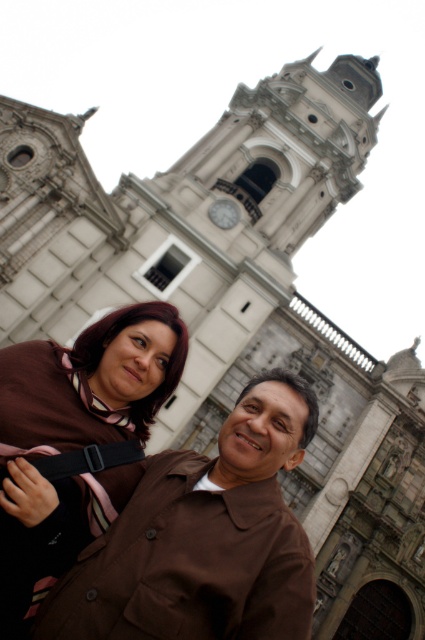
Does brown matte jacket at center have a larger size compared to brown fabric at center?

Yes, brown matte jacket at center is bigger than brown fabric at center.

Does point (181, 508) come in front of point (76, 342)?

Yes, it is in front of point (76, 342).

Describe the element at coordinates (203, 538) in the screenshot. I see `brown matte jacket at center` at that location.

Find the location of a particular element. Image resolution: width=425 pixels, height=640 pixels. brown matte jacket at center is located at coordinates (203, 538).

Can you confirm if brown fabric at lower left is smaller than brown fabric at center?

Incorrect, brown fabric at lower left is not smaller in size than brown fabric at center.

Is point (164, 305) positioned behind point (176, 332)?

Yes, it is behind point (176, 332).

Which is in front, point (51, 342) or point (181, 336)?

Point (51, 342) is more forward.

Identify the location of brown fabric at lower left. The width and height of the screenshot is (425, 640). (76, 436).

Who is positioned more to the right, brown matte jacket at center or matte brown jacket at lower center?

matte brown jacket at lower center is more to the right.

Is brown matte jacket at center closer to the viewer compared to matte brown jacket at lower center?

Yes, it is.

Does point (164, 486) come closer to viewer compared to point (282, 381)?

Yes, point (164, 486) is in front of point (282, 381).

Locate an element on the screen. Image resolution: width=425 pixels, height=640 pixels. brown matte jacket at center is located at coordinates (203, 538).